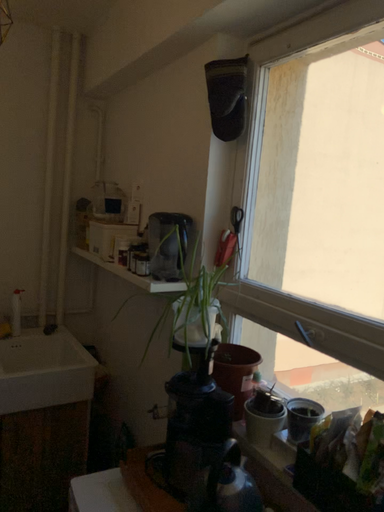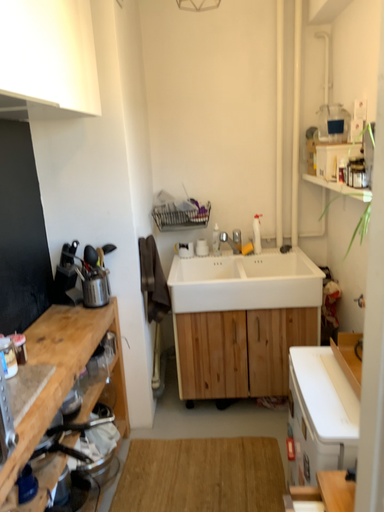
Question: How did the camera likely rotate when shooting the video?

Choices:
 (A) rotated left
 (B) rotated right

Answer: (A)